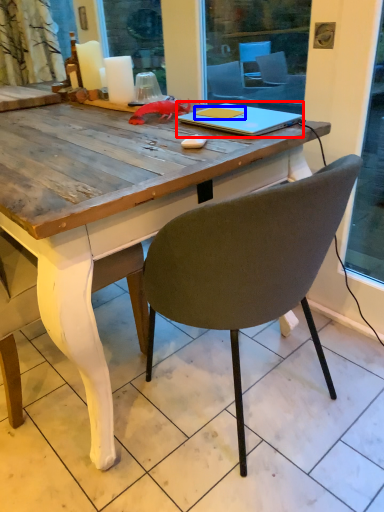
Question: Among these objects, which one is nearest to the camera, notebook (highlighted by a red box) or notebook (highlighted by a blue box)?

Choices:
 (A) notebook
 (B) notebook

Answer: (A)